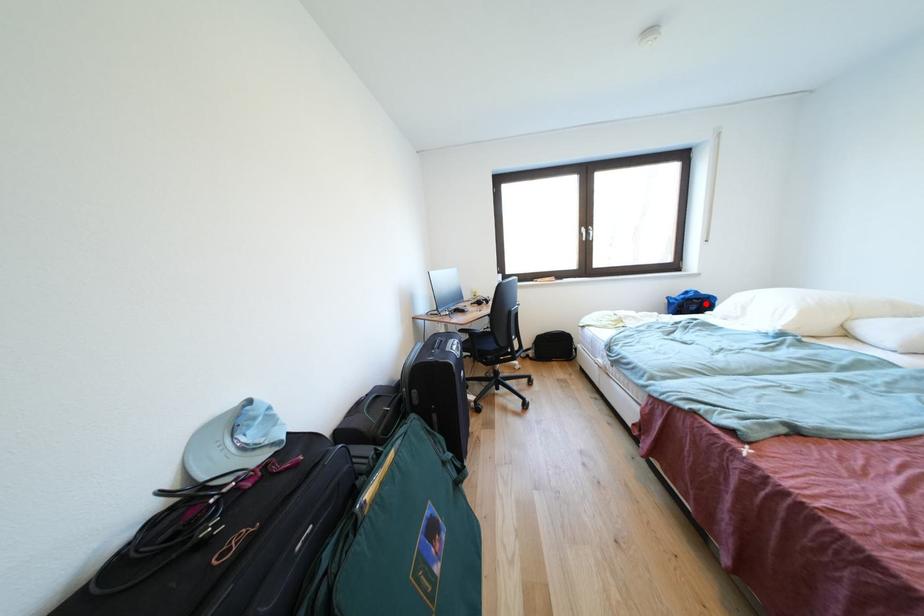
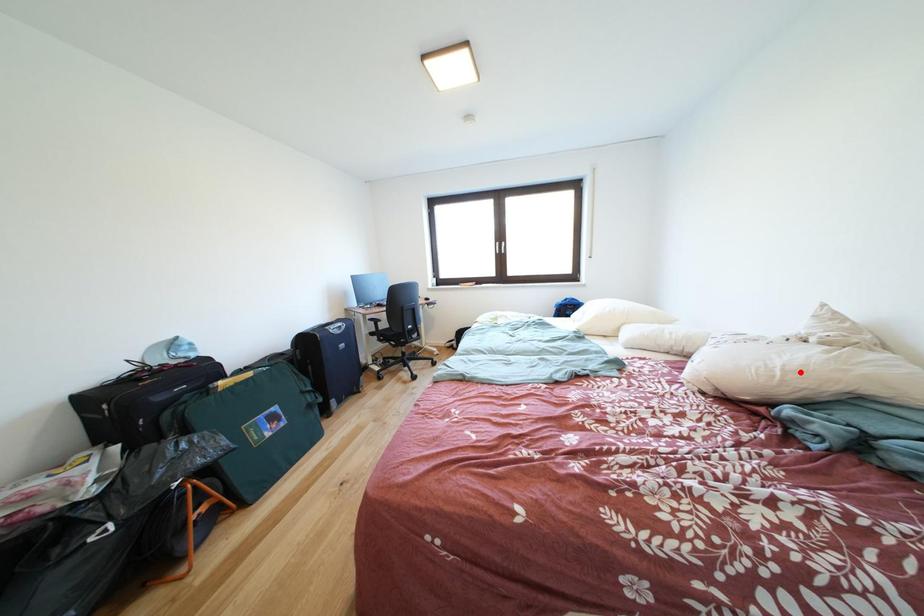
I am providing you with two images of the same scene from different viewpoints. A red point is marked on the first image and another point is marked on the second image. Is the marked point in image1 the same physical position as the marked point in image2?

No